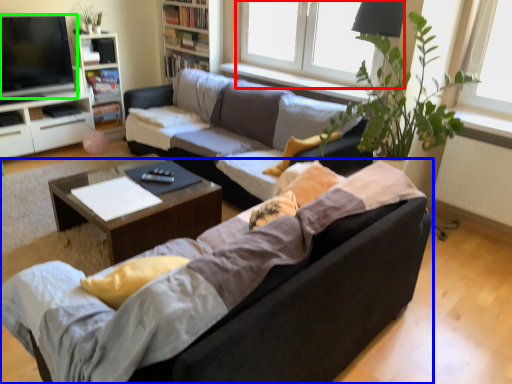
Question: Which object is the closest to the window (highlighted by a red box)? Choose among these: studio couch (highlighted by a blue box) or television (highlighted by a green box).

Choices:
 (A) studio couch
 (B) television

Answer: (B)